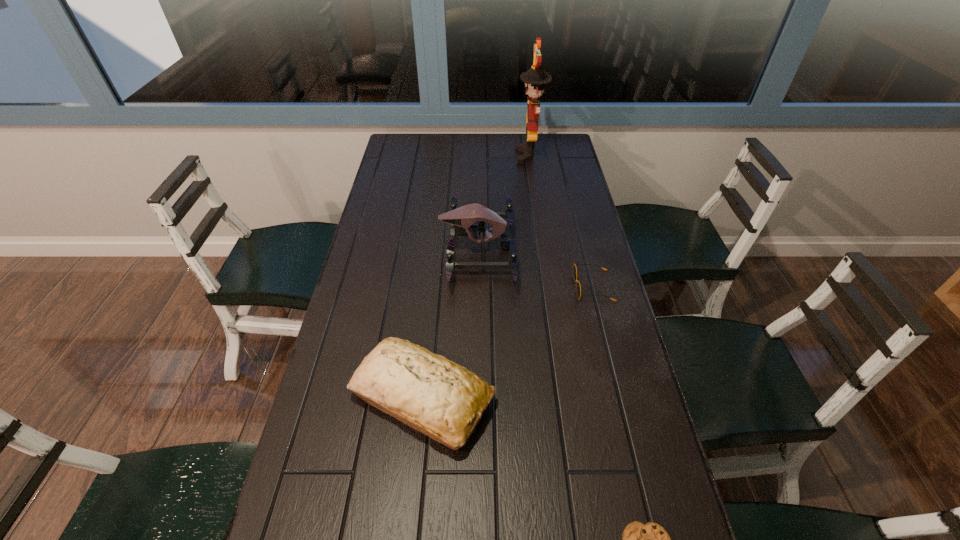
Image resolution: width=960 pixels, height=540 pixels. I want to click on free spot at the left edge of the desktop, so click(344, 533).

This screenshot has width=960, height=540. I want to click on free region at the right edge of the desktop, so click(x=625, y=351).

In the image, there is a desktop. Identify the location of vacant space at the far left corner. (417, 134).

I want to click on free space at the far right corner, so click(x=543, y=137).

Identify the location of free spot between the nutcracker and the fourth shortest object. The height and width of the screenshot is (540, 960). (504, 201).

Find the location of a particular element. This screenshot has width=960, height=540. blank region between the drone and the sunglasses is located at coordinates (536, 267).

This screenshot has height=540, width=960. What are the coordinates of `empty location between the bread and the farthest object` in the screenshot? It's located at click(x=476, y=276).

This screenshot has height=540, width=960. I want to click on empty location between the bread and the sunglasses, so click(508, 342).

The image size is (960, 540). Find the location of `vacant region between the third shortest object and the second shortest object`. vacant region between the third shortest object and the second shortest object is located at coordinates (508, 342).

Locate an element on the screen. empty space between the fourth tallest object and the nutcracker is located at coordinates (562, 221).